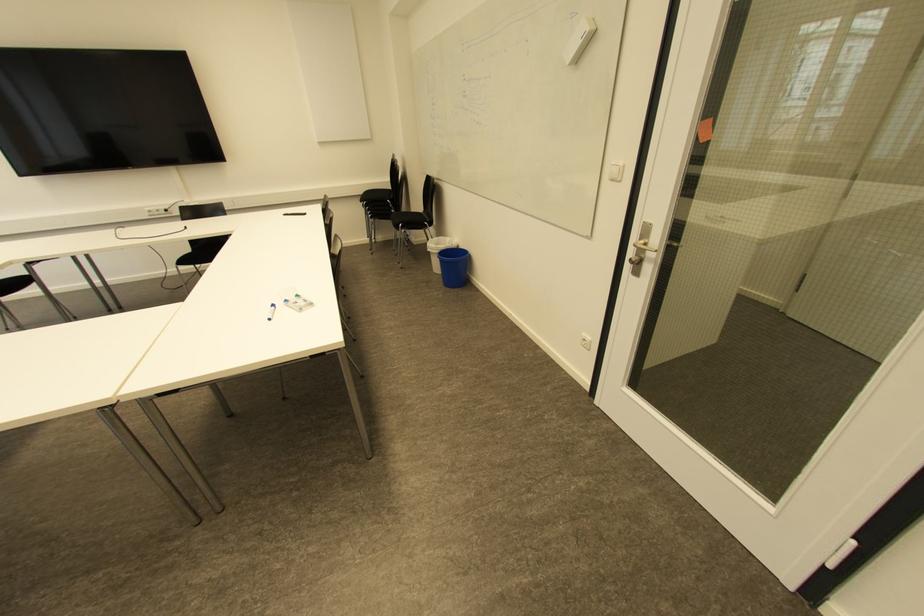
The height and width of the screenshot is (616, 924). I want to click on white light switch, so click(614, 171).